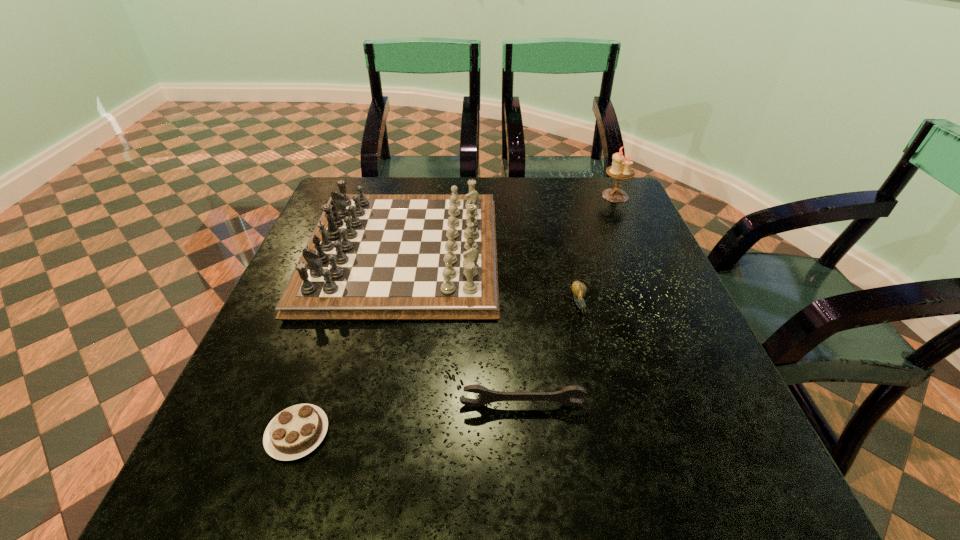
The width and height of the screenshot is (960, 540). In order to click on object present at the far right corner in this screenshot , I will do `click(621, 169)`.

This screenshot has width=960, height=540. In the image, there is a desktop. What are the coordinates of `free region at the far edge` in the screenshot? It's located at (420, 192).

You are a GUI agent. You are given a task and a screenshot of the screen. Output one action in this format:
    pyautogui.click(x=<x>, y=<y>)
    Task: Click on the free space at the near edge of the desktop
    The width and height of the screenshot is (960, 540).
    Given the screenshot: What is the action you would take?
    pyautogui.click(x=626, y=507)

This screenshot has height=540, width=960. In the image, there is a desktop. What are the coordinates of `vacant area at the left edge` in the screenshot? It's located at (303, 388).

Locate an element on the screen. This screenshot has height=540, width=960. vacant space at the right edge of the desktop is located at coordinates (611, 297).

Find the location of `vacant region at the near left corner of the desktop`. vacant region at the near left corner of the desktop is located at coordinates coord(180,493).

In the image, there is a desktop. Where is `free region at the far right corner`? The height and width of the screenshot is (540, 960). free region at the far right corner is located at coordinates (636, 214).

Where is `vacant area between the candle holder and the chessboard`? vacant area between the candle holder and the chessboard is located at coordinates (509, 224).

Locate an element on the screen. free space between the chessboard and the third tallest object is located at coordinates (462, 328).

What are the coordinates of `free spot between the fourth tallest object and the shortest object` in the screenshot? It's located at (439, 369).